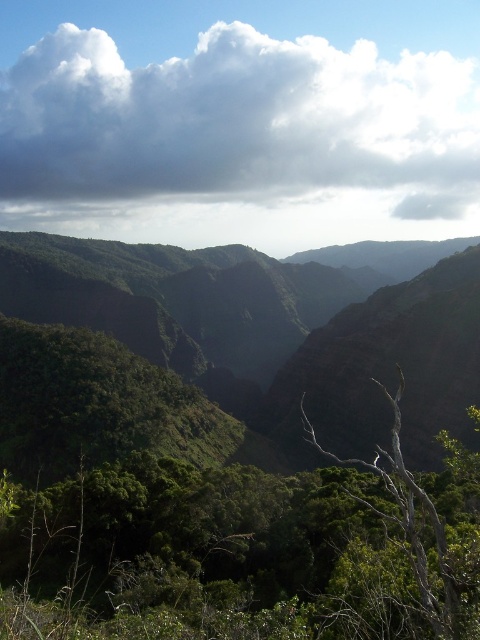
You are a hiker planning to take a photo of the gray bark tree at center from the white fluffy cloud at upper center. Given that the distance between them is 672.20 meters, can you estimate how far you need to move to capture the tree in your shot?

To capture the gray bark tree at center from the white fluffy cloud at upper center, you need to move 672.20 meters towards the tree since the distance between them is exactly that.

You are a hiker who wants to take a photo of the gray bark tree at center without any obstructions. Is the white fluffy cloud at upper center blocking your view of the tree?

The gray bark tree at center is behind the white fluffy cloud at upper center, so the cloud is blocking the view of the tree.

You are standing at the base of the mountain in the scene and want to reach the two points marked in the image. Which point, point (x=142, y=100) or point (x=391, y=484), is closer to you?

Point (x=142, y=100) is closer to you because it is further to the viewer than point (x=391, y=484).